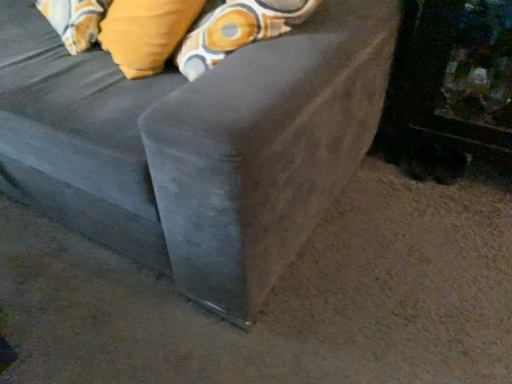
The height and width of the screenshot is (384, 512). Describe the element at coordinates (196, 145) in the screenshot. I see `suede-like gray couch at center` at that location.

Where is `suede-like gray couch at center`? suede-like gray couch at center is located at coordinates (196, 145).

What is the approximate width of suede-like gray couch at center?

4.88 feet.

Identify the location of suede-like gray couch at center. The image size is (512, 384). (196, 145).